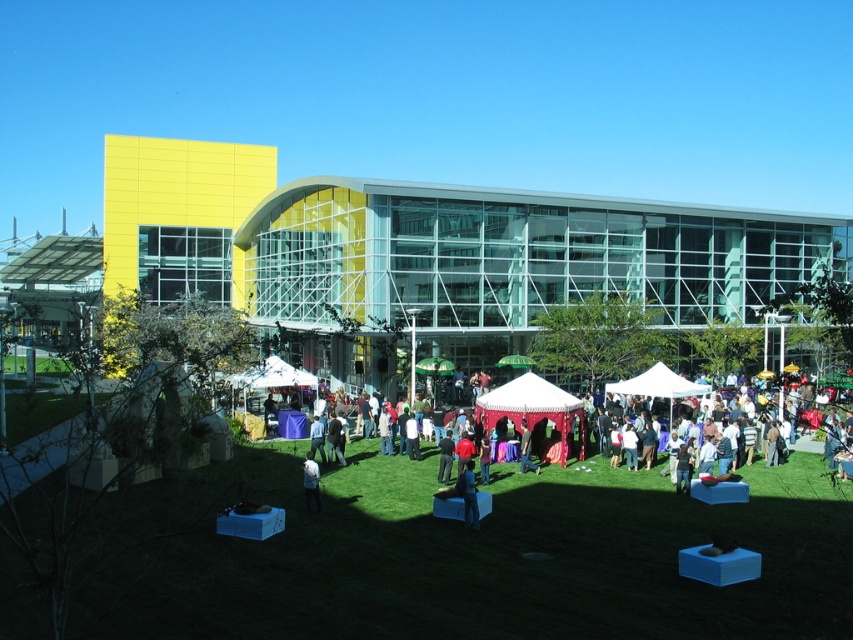
Question: Is white fabric tent at center to the left of white fabric at center from the viewer's perspective?

Choices:
 (A) no
 (B) yes

Answer: (A)

Question: Is white fabric tent at center wider than dark blue shirt at center?

Choices:
 (A) no
 (B) yes

Answer: (B)

Question: Which of the following is the closest to the observer?

Choices:
 (A) dark blue shirt at center
 (B) white fabric tent at center
 (C) red fabric tent at center

Answer: (B)

Question: Among these points, which one is nearest to the camera?

Choices:
 (A) (570, 397)
 (B) (756, 492)

Answer: (B)

Question: Is white fabric tent at center smaller than white fabric at center?

Choices:
 (A) yes
 (B) no

Answer: (B)

Question: Which object appears farthest from the camera in this image?

Choices:
 (A) dark blue shirt at center
 (B) white fabric at center
 (C) white fabric tent at center
 (D) red fabric tent at center

Answer: (D)